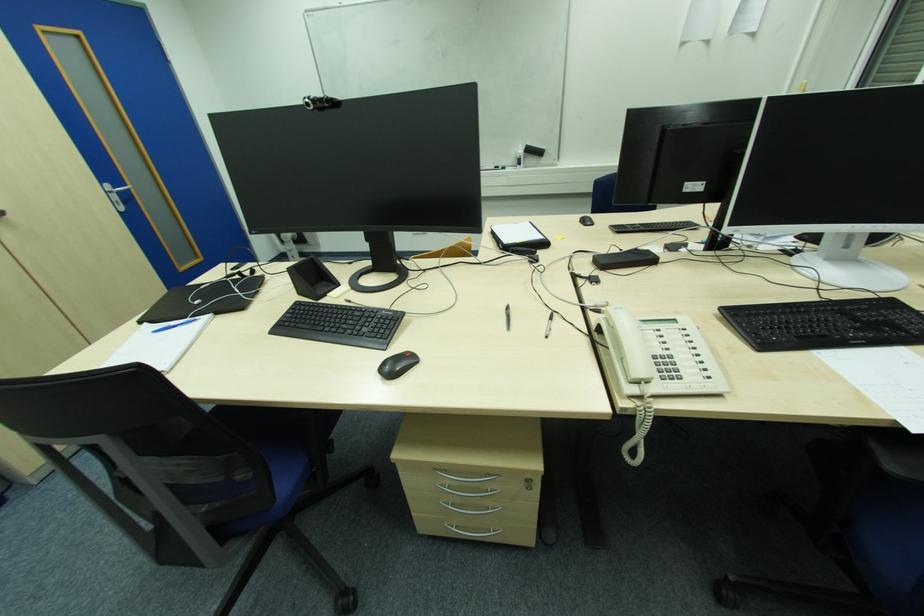
The location [532,153] corresponds to which object?

This point indicates the whiteboard eraser.